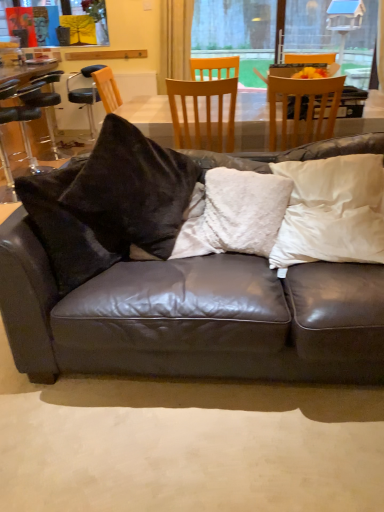
Question: Is the depth of fluffy white pillow at center, the 2th pillow when ordered from right to left, less than that of white soft pillow at right, the second pillow viewed from the left?

Choices:
 (A) no
 (B) yes

Answer: (A)

Question: Does fluffy white pillow at center, which appears as the 1th pillow when viewed from the left, lie behind white soft pillow at right, which ranks as the first pillow in right-to-left order?

Choices:
 (A) yes
 (B) no

Answer: (A)

Question: Is fluffy white pillow at center, the 2th pillow when ordered from right to left, looking in the opposite direction of white soft pillow at right, the second pillow viewed from the left?

Choices:
 (A) no
 (B) yes

Answer: (A)

Question: Can you confirm if fluffy white pillow at center, which appears as the 1th pillow when viewed from the left, is smaller than white soft pillow at right, which ranks as the first pillow in right-to-left order?

Choices:
 (A) yes
 (B) no

Answer: (A)

Question: Considering the relative sizes of fluffy white pillow at center, the 2th pillow when ordered from right to left, and white soft pillow at right, the second pillow viewed from the left, in the image provided, is fluffy white pillow at center, the 2th pillow when ordered from right to left, taller than white soft pillow at right, the second pillow viewed from the left,?

Choices:
 (A) yes
 (B) no

Answer: (B)

Question: Which is correct: yellow fabric at upper left is inside white soft pillow at right, the second pillow viewed from the left, or outside of it?

Choices:
 (A) outside
 (B) inside

Answer: (A)

Question: From their relative heights in the image, would you say yellow fabric at upper left is taller or shorter than white soft pillow at right, the second pillow viewed from the left?

Choices:
 (A) tall
 (B) short

Answer: (A)

Question: Is point (74, 2) closer or farther from the camera than point (347, 174)?

Choices:
 (A) farther
 (B) closer

Answer: (A)

Question: Is yellow fabric at upper left in front of or behind white soft pillow at right, which ranks as the first pillow in right-to-left order, in the image?

Choices:
 (A) behind
 (B) front

Answer: (A)

Question: From a real-world perspective, is light brown wooden chair at upper center, the 3th chair from the left, above or below yellow fabric at upper left?

Choices:
 (A) below
 (B) above

Answer: (A)

Question: Looking at the image, does light brown wooden chair at upper center, which appears as the first chair when viewed from the right, seem bigger or smaller compared to yellow fabric at upper left?

Choices:
 (A) big
 (B) small

Answer: (A)

Question: Is point (281, 91) positioned closer to the camera than point (6, 30)?

Choices:
 (A) closer
 (B) farther

Answer: (A)

Question: From the image's perspective, is light brown wooden chair at upper center, which is the 3th chair from back to front, above or below yellow fabric at upper left?

Choices:
 (A) above
 (B) below

Answer: (B)

Question: Is yellow fabric at upper left spatially inside light brown wooden chair at upper center, which is the 3th chair from back to front, or outside of it?

Choices:
 (A) outside
 (B) inside

Answer: (A)

Question: From a real-world perspective, is yellow fabric at upper left above or below light brown wooden chair at upper center, which appears as the 1th chair when viewed from the front?

Choices:
 (A) above
 (B) below

Answer: (A)